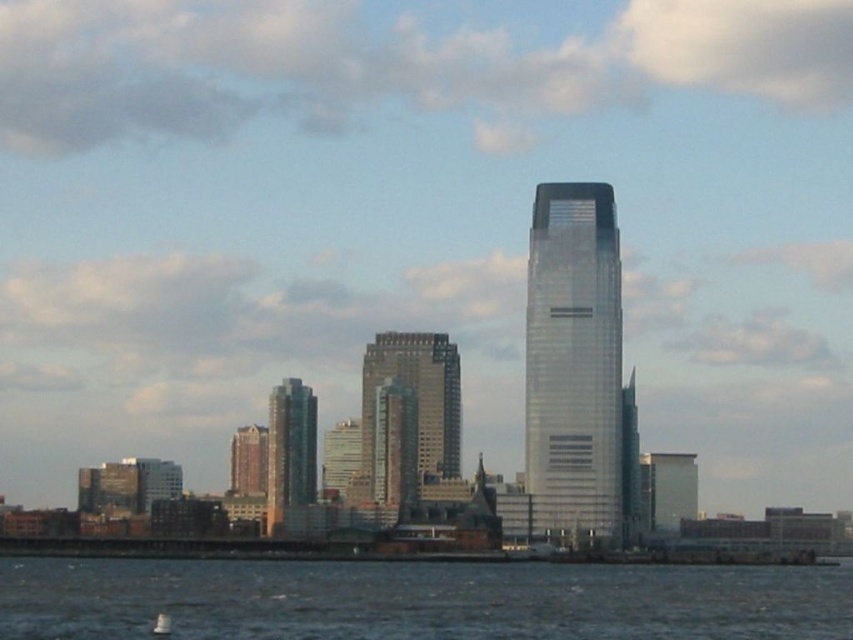
Who is taller, dark blue water at lower center or silver glass skyscraper at center?

silver glass skyscraper at center

At what (x,y) coordinates should I click in order to perform the action: click on dark blue water at lower center. Please return your answer as a coordinate pair (x, y). This screenshot has height=640, width=853. Looking at the image, I should click on point(419,600).

From the picture: Does silver glass skyscraper at center appear on the left side of metallic glass building at center?

No, silver glass skyscraper at center is not to the left of metallic glass building at center.

Does silver glass skyscraper at center have a larger size compared to metallic glass building at center?

Indeed, silver glass skyscraper at center has a larger size compared to metallic glass building at center.

Who is more forward, [538,358] or [315,420]?

Positioned in front is point [538,358].

At what (x,y) coordinates should I click in order to perform the action: click on silver glass skyscraper at center. Please return your answer as a coordinate pair (x, y). Looking at the image, I should click on (573, 362).

Which is behind, point (270, 492) or point (154, 630)?

The point (154, 630) is behind.

Is the position of metallic glass building at center less distant than that of white plastic boat at lower left?

Yes, it is.

I want to click on metallic glass building at center, so click(x=289, y=451).